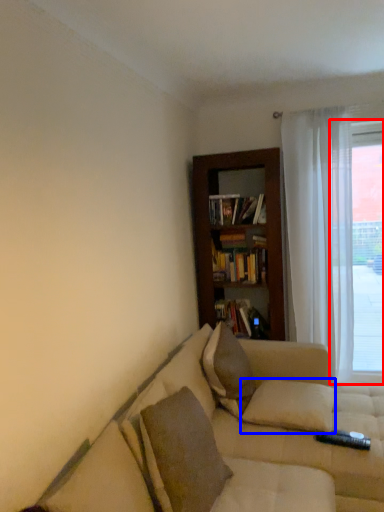
Question: Which object appears farthest to the camera in this image, window (highlighted by a red box) or pillow (highlighted by a blue box)?

Choices:
 (A) window
 (B) pillow

Answer: (A)